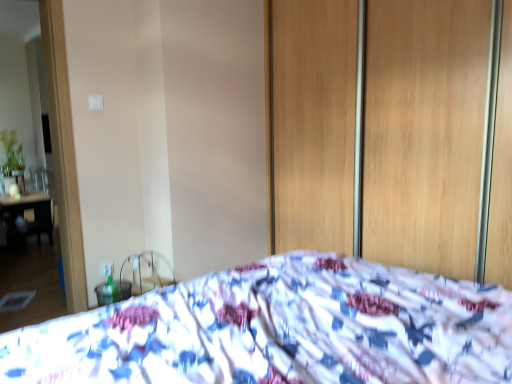
Question: Does wooden screen door at center lie in front of white printed fabric bed at center?

Choices:
 (A) no
 (B) yes

Answer: (A)

Question: From the image's perspective, is wooden screen door at center under white printed fabric bed at center?

Choices:
 (A) no
 (B) yes

Answer: (A)

Question: From the image's perspective, does wooden screen door at center appear higher than white printed fabric bed at center?

Choices:
 (A) no
 (B) yes

Answer: (B)

Question: From a real-world perspective, is wooden screen door at center physically below white printed fabric bed at center?

Choices:
 (A) no
 (B) yes

Answer: (A)

Question: Considering the relative sizes of wooden screen door at center and white printed fabric bed at center in the image provided, is wooden screen door at center taller than white printed fabric bed at center?

Choices:
 (A) yes
 (B) no

Answer: (A)

Question: Does wooden screen door at center have a larger size compared to white printed fabric bed at center?

Choices:
 (A) no
 (B) yes

Answer: (A)

Question: Would you say white printed fabric bed at center contains wooden screen door at center?

Choices:
 (A) no
 (B) yes

Answer: (A)

Question: Is white printed fabric bed at center next to wooden screen door at center and touching it?

Choices:
 (A) no
 (B) yes

Answer: (A)

Question: Does white printed fabric bed at center have a greater width compared to wooden screen door at center?

Choices:
 (A) yes
 (B) no

Answer: (A)

Question: Is white printed fabric bed at center turned away from wooden screen door at center?

Choices:
 (A) yes
 (B) no

Answer: (B)

Question: Is white printed fabric bed at center further to camera compared to wooden screen door at center?

Choices:
 (A) no
 (B) yes

Answer: (A)

Question: Can you confirm if white printed fabric bed at center is thinner than wooden screen door at center?

Choices:
 (A) no
 (B) yes

Answer: (A)

Question: Relative to white printed fabric bed at center, is wooden screen door at center in front or behind?

Choices:
 (A) behind
 (B) front

Answer: (A)